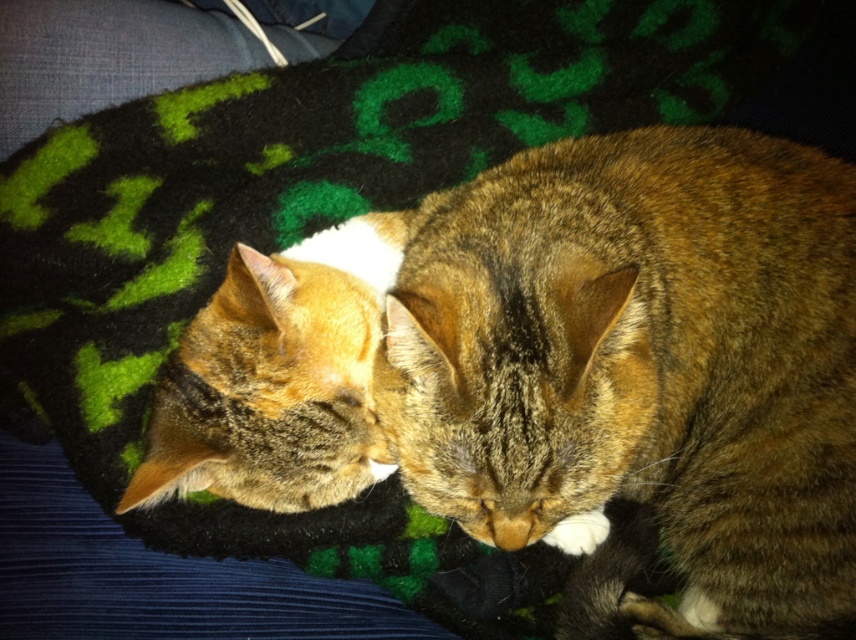
Question: Among these points, which one is nearest to the camera?

Choices:
 (A) (577, 353)
 (B) (355, 323)

Answer: (A)

Question: Can you confirm if tabby fur cat at center is positioned below tabby fur cat at left?

Choices:
 (A) no
 (B) yes

Answer: (B)

Question: Which point is closer to the camera taking this photo?

Choices:
 (A) (693, 515)
 (B) (233, 486)

Answer: (B)

Question: Is tabby fur cat at center positioned at the back of tabby fur cat at left?

Choices:
 (A) no
 (B) yes

Answer: (A)

Question: Considering the relative positions of tabby fur cat at center and tabby fur cat at left in the image provided, where is tabby fur cat at center located with respect to tabby fur cat at left?

Choices:
 (A) above
 (B) below

Answer: (B)

Question: Which point appears closest to the camera in this image?

Choices:
 (A) (198, 412)
 (B) (822, 589)

Answer: (A)